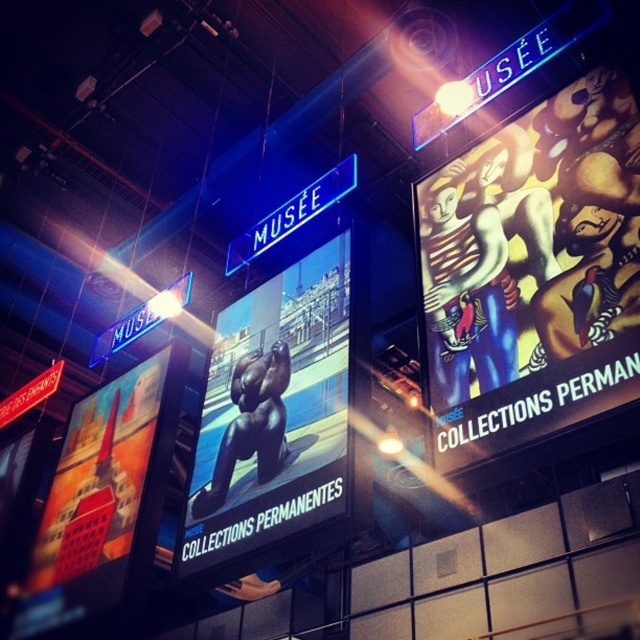
Does black glossy bear at center come behind shiny black bear at left?

Yes, black glossy bear at center is further from the viewer.

You are a GUI agent. You are given a task and a screenshot of the screen. Output one action in this format:
    pyautogui.click(x=<x>, y=<y>)
    Task: Click on the black glossy bear at center
    This screenshot has height=640, width=640.
    Given the screenshot: What is the action you would take?
    pyautogui.click(x=273, y=413)

Describe the element at coordinates (532, 273) in the screenshot. The height and width of the screenshot is (640, 640). I see `matte colorful painting at upper right` at that location.

Image resolution: width=640 pixels, height=640 pixels. I want to click on matte colorful painting at upper right, so click(532, 273).

Where is `matte colorful painting at upper right`? This screenshot has width=640, height=640. matte colorful painting at upper right is located at coordinates (532, 273).

Between point (570, 184) and point (160, 378), which one is positioned behind?

Point (160, 378)

Who is lower down, matte colorful painting at upper right or shiny black bear at left?

shiny black bear at left is lower down.

Is point (548, 116) closer to viewer compared to point (48, 579)?

That is True.

Find the location of a particular element. This screenshot has height=640, width=640. matte colorful painting at upper right is located at coordinates (532, 273).